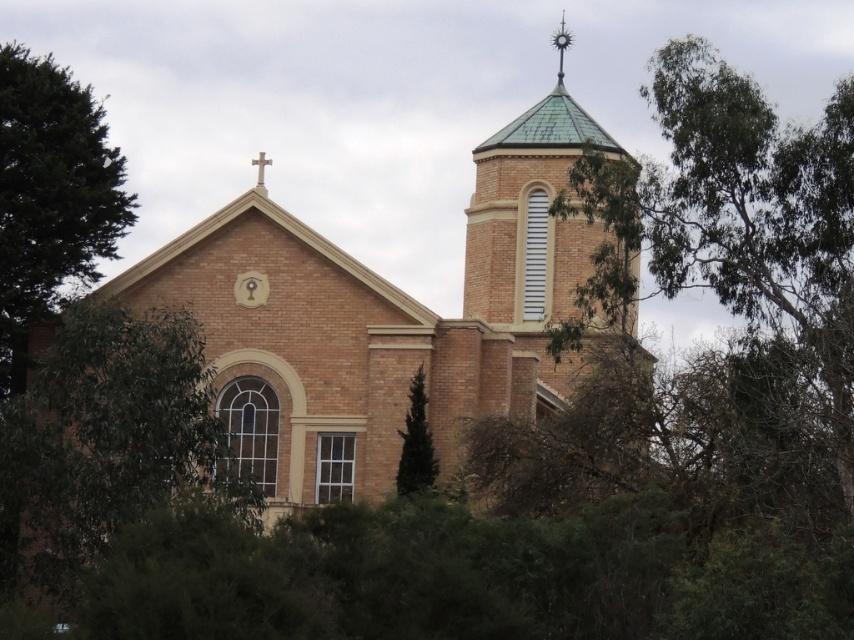
Question: In this image, where is green leafy tree at lower left located relative to green leafy tree at left?

Choices:
 (A) below
 (B) above

Answer: (A)

Question: Which of the following is the closest to the observer?

Choices:
 (A) (570, 38)
 (B) (509, 141)
 (C) (396, 474)

Answer: (C)

Question: Where is green leafy tree at lower left located in relation to green coniferous tree at center in the image?

Choices:
 (A) right
 (B) left

Answer: (B)

Question: Does green leafy tree at left have a greater width compared to metallic spire at upper center?

Choices:
 (A) no
 (B) yes

Answer: (B)

Question: Which point is farther from the camera taking this photo?

Choices:
 (A) (262, 160)
 (B) (98, 515)
 (C) (477, 394)
 (D) (401, 444)

Answer: (A)

Question: Which point appears closest to the camera in this image?

Choices:
 (A) (50, 147)
 (B) (259, 417)

Answer: (B)